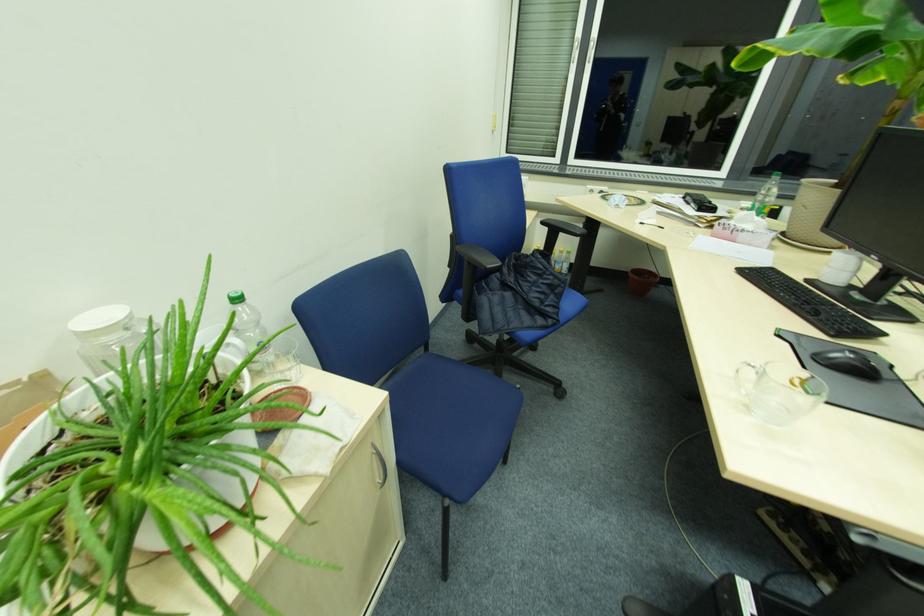
Image resolution: width=924 pixels, height=616 pixels. What do you see at coordinates (380, 464) in the screenshot?
I see `a silver cabinet handle` at bounding box center [380, 464].